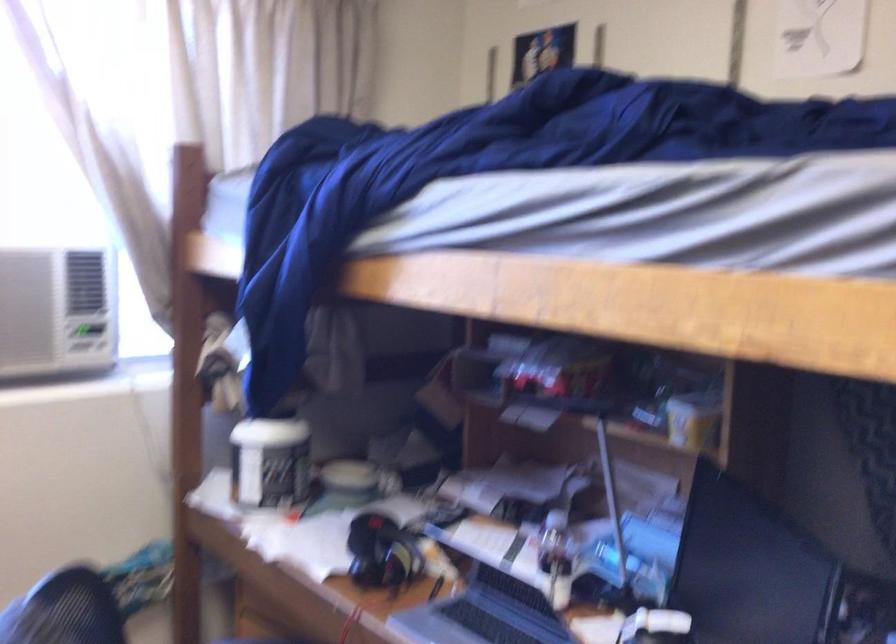
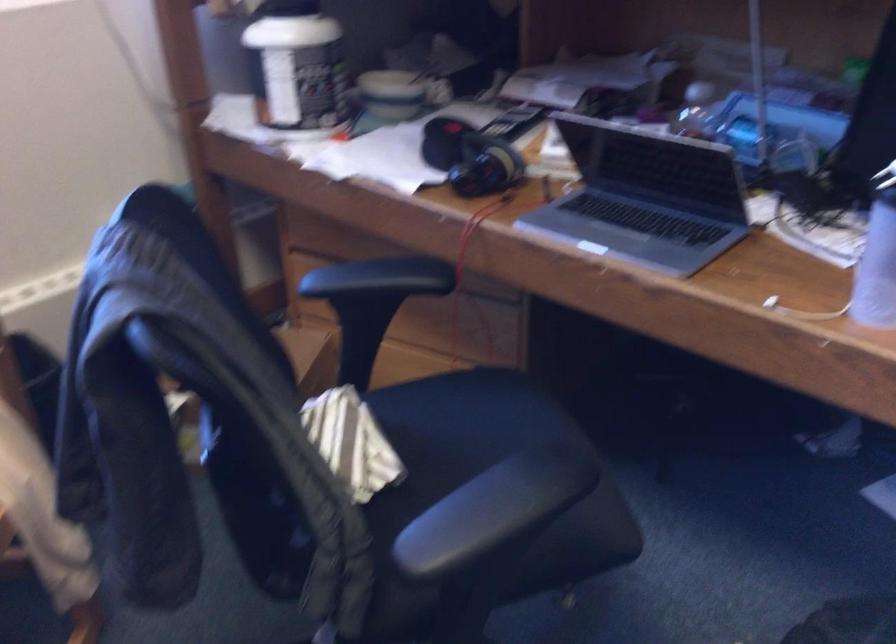
The point at (x=384, y=552) is marked in the first image. Where is the corresponding point in the second image?

(470, 158)